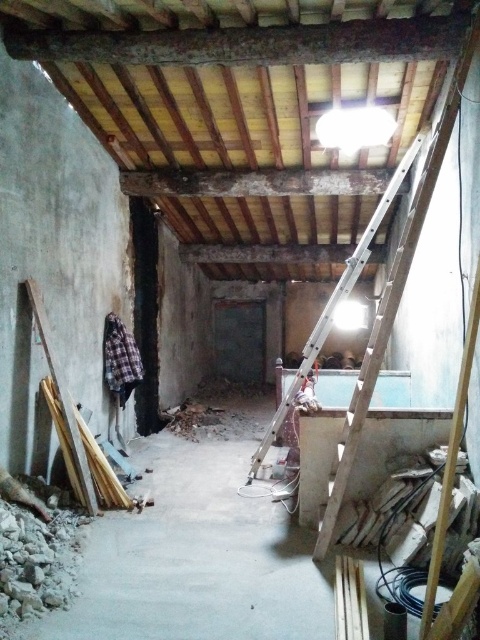
Question: Estimate the real-world distances between objects in this image. Which object is closer to the concrete floor at center?

Choices:
 (A) wooden ladder at upper right
 (B) silver metallic ladder at center

Answer: (A)

Question: Which point is closer to the camera?

Choices:
 (A) concrete floor at center
 (B) wooden ladder at upper right
 (C) silver metallic ladder at center

Answer: (A)

Question: Which object appears farthest from the camera in this image?

Choices:
 (A) concrete floor at center
 (B) silver metallic ladder at center
 (C) wooden ladder at upper right

Answer: (B)

Question: Can you confirm if concrete floor at center is thinner than silver metallic ladder at center?

Choices:
 (A) yes
 (B) no

Answer: (B)

Question: Can you confirm if concrete floor at center is positioned to the left of wooden ladder at upper right?

Choices:
 (A) no
 (B) yes

Answer: (B)

Question: Is wooden ladder at upper right to the right of silver metallic ladder at center from the viewer's perspective?

Choices:
 (A) no
 (B) yes

Answer: (B)